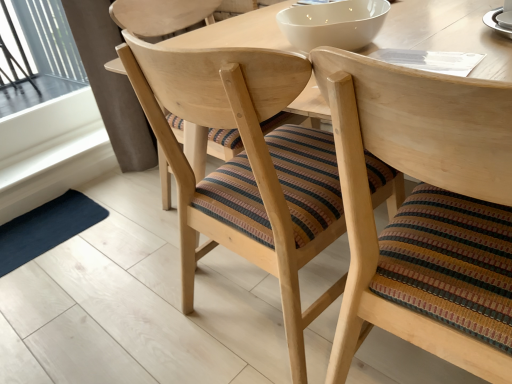
Describe the element at coordinates (46, 228) in the screenshot. This screenshot has width=512, height=384. I see `dark blue fabric mat at lower left` at that location.

What do you see at coordinates (246, 167) in the screenshot? I see `wooden chair with striped cushion at center, which is counted as the second chair, starting from the right` at bounding box center [246, 167].

You are a GUI agent. You are given a task and a screenshot of the screen. Output one action in this format:
    pyautogui.click(x=<x>, y=<y>)
    Task: Click on the dark blue fabric mat at lower left
    The height and width of the screenshot is (384, 512).
    Given the screenshot: What is the action you would take?
    pyautogui.click(x=46, y=228)

At what (x,y) coordinates should I click in order to perform the action: click on saucer on the right side of white glossy bowl at upper center. Please return your answer as a coordinate pair (x, y). Looking at the image, I should click on (496, 22).

In the image, is white glossy saucer at upper right on the left side or the right side of white glossy bowl at upper center?

Clearly, white glossy saucer at upper right is on the right of white glossy bowl at upper center in the image.

Could you tell me if white glossy saucer at upper right is turned towards white glossy bowl at upper center?

No.

Are white glossy saucer at upper right and white glossy bowl at upper center located far from each other?

No, white glossy saucer at upper right is not far away from white glossy bowl at upper center.

How distant is white glossy saucer at upper right from wooden chair with striped cushion at center, the second chair viewed from the left?

21.50 inches.

Would you consider white glossy saucer at upper right to be distant from wooden chair with striped cushion at center, the second chair viewed from the left?

That's not correct — white glossy saucer at upper right is a little close to wooden chair with striped cushion at center, the second chair viewed from the left.

Between white glossy saucer at upper right and wooden chair with striped cushion at center, the first chair from the right, which one appears on the left side from the viewer's perspective?

Positioned to the left is wooden chair with striped cushion at center, the first chair from the right.

Is white glossy saucer at upper right inside or outside of wooden chair with striped cushion at center, the first chair from the right?

The correct answer is: outside.

In terms of size, does wooden chair with striped cushion at center, which is counted as the second chair, starting from the right, appear bigger or smaller than wooden chair with striped cushion at center, the first chair from the right?

Considering their sizes, wooden chair with striped cushion at center, which is counted as the second chair, starting from the right, takes up more space than wooden chair with striped cushion at center, the first chair from the right.

From the picture: In terms of height, does wooden chair with striped cushion at center, which is counted as the second chair, starting from the right, look taller or shorter compared to wooden chair with striped cushion at center, the first chair from the right?

wooden chair with striped cushion at center, which is counted as the second chair, starting from the right, is shorter than wooden chair with striped cushion at center, the first chair from the right.

Does wooden chair with striped cushion at center, arranged as the first chair when viewed from the left, have a greater width compared to wooden chair with striped cushion at center, the second chair viewed from the left?

Indeed, wooden chair with striped cushion at center, arranged as the first chair when viewed from the left, has a greater width compared to wooden chair with striped cushion at center, the second chair viewed from the left.

Considering the positions of points (18, 225) and (412, 163), is point (18, 225) closer to camera compared to point (412, 163)?

No, (18, 225) is behind (412, 163).

Is dark blue fabric mat at lower left completely or partially outside of wooden chair with striped cushion at center, the first chair from the right?

dark blue fabric mat at lower left lies outside wooden chair with striped cushion at center, the first chair from the right,'s area.

From a real-world perspective, is dark blue fabric mat at lower left physically below wooden chair with striped cushion at center, the second chair viewed from the left?

Correct, in the physical world, dark blue fabric mat at lower left is lower than wooden chair with striped cushion at center, the second chair viewed from the left.

Is point (509, 35) behind point (28, 227)?

No, (509, 35) is closer to viewer.

Is white glossy saucer at upper right situated inside dark blue fabric mat at lower left or outside?

The correct answer is: outside.

Consider the image. Can you tell me how much white glossy saucer at upper right and dark blue fabric mat at lower left differ in facing direction?

86 degrees.

In the scene shown: Does white glossy saucer at upper right have a greater height compared to dark blue fabric mat at lower left?

No, white glossy saucer at upper right is not taller than dark blue fabric mat at lower left.

Image resolution: width=512 pixels, height=384 pixels. I want to click on mat that appears behind the wooden chair with striped cushion at center, arranged as the first chair when viewed from the left, so click(x=46, y=228).

In the image, is wooden chair with striped cushion at center, arranged as the first chair when viewed from the left, positioned in front of or behind dark blue fabric mat at lower left?

wooden chair with striped cushion at center, arranged as the first chair when viewed from the left, is positioned closer to the viewer than dark blue fabric mat at lower left.

Is wooden chair with striped cushion at center, which is counted as the second chair, starting from the right, wider than dark blue fabric mat at lower left?

Yes, wooden chair with striped cushion at center, which is counted as the second chair, starting from the right, is wider than dark blue fabric mat at lower left.

Considering the sizes of objects dark blue fabric mat at lower left and white glossy saucer at upper right in the image provided, who is wider, dark blue fabric mat at lower left or white glossy saucer at upper right?

dark blue fabric mat at lower left.

From a real-world perspective, between dark blue fabric mat at lower left and white glossy saucer at upper right, who is vertically lower?

dark blue fabric mat at lower left.

You are a GUI agent. You are given a task and a screenshot of the screen. Output one action in this format:
    pyautogui.click(x=<x>, y=<y>)
    Task: Click on the bowl above the white glossy saucer at upper right (from the image's perspective)
    This screenshot has height=384, width=512.
    Given the screenshot: What is the action you would take?
    pyautogui.click(x=333, y=24)

From the white glossy saucer at upper right, count the 1st chair to the left and point to it. Please provide its 2D coordinates.

[(425, 211)]

When comparing their distances from white glossy saucer at upper right, does white glossy bowl at upper center or wooden chair with striped cushion at center, which is counted as the second chair, starting from the right, seem closer?

white glossy bowl at upper center is positioned closer to the anchor white glossy saucer at upper right.

Consider the image. From the image, which object appears to be nearer to white glossy saucer at upper right, dark blue fabric mat at lower left or wooden chair with striped cushion at center, arranged as the first chair when viewed from the left?

wooden chair with striped cushion at center, arranged as the first chair when viewed from the left, is positioned closer to the anchor white glossy saucer at upper right.

Which object lies nearer to the anchor point wooden chair with striped cushion at center, which is counted as the second chair, starting from the right, wooden chair with striped cushion at center, the second chair viewed from the left, or dark blue fabric mat at lower left?

wooden chair with striped cushion at center, the second chair viewed from the left.

Looking at the image, which one is located further to white glossy bowl at upper center, white glossy saucer at upper right or wooden chair with striped cushion at center, which is counted as the second chair, starting from the right?

wooden chair with striped cushion at center, which is counted as the second chair, starting from the right.

Which object lies nearer to the anchor point wooden chair with striped cushion at center, the second chair viewed from the left, wooden chair with striped cushion at center, which is counted as the second chair, starting from the right, or dark blue fabric mat at lower left?

wooden chair with striped cushion at center, which is counted as the second chair, starting from the right, lies closer to wooden chair with striped cushion at center, the second chair viewed from the left, than the other object.

Based on their spatial positions, is dark blue fabric mat at lower left or wooden chair with striped cushion at center, the second chair viewed from the left, further from wooden chair with striped cushion at center, arranged as the first chair when viewed from the left?

dark blue fabric mat at lower left is positioned further to the anchor wooden chair with striped cushion at center, arranged as the first chair when viewed from the left.

Estimate the real-world distances between objects in this image. Which object is further from white glossy bowl at upper center, dark blue fabric mat at lower left or wooden chair with striped cushion at center, arranged as the first chair when viewed from the left?

dark blue fabric mat at lower left is further to white glossy bowl at upper center.

Which object lies nearer to the anchor point wooden chair with striped cushion at center, the first chair from the right, wooden chair with striped cushion at center, which is counted as the second chair, starting from the right, or white glossy bowl at upper center?

Among the two, wooden chair with striped cushion at center, which is counted as the second chair, starting from the right, is located nearer to wooden chair with striped cushion at center, the first chair from the right.

The image size is (512, 384). Find the location of `bowl located between wooden chair with striped cushion at center, which is counted as the second chair, starting from the right, and white glossy saucer at upper right in the left-right direction`. bowl located between wooden chair with striped cushion at center, which is counted as the second chair, starting from the right, and white glossy saucer at upper right in the left-right direction is located at coordinates (333, 24).

What are the coordinates of `chair located between dark blue fabric mat at lower left and wooden chair with striped cushion at center, the second chair viewed from the left, in the left-right direction` in the screenshot? It's located at [246, 167].

Find the location of `chair between dark blue fabric mat at lower left and white glossy bowl at upper center in the horizontal direction`. chair between dark blue fabric mat at lower left and white glossy bowl at upper center in the horizontal direction is located at coordinates (246, 167).

Where is `chair between white glossy bowl at upper center and wooden chair with striped cushion at center, the second chair viewed from the left, in the vertical direction`? chair between white glossy bowl at upper center and wooden chair with striped cushion at center, the second chair viewed from the left, in the vertical direction is located at coordinates (246, 167).